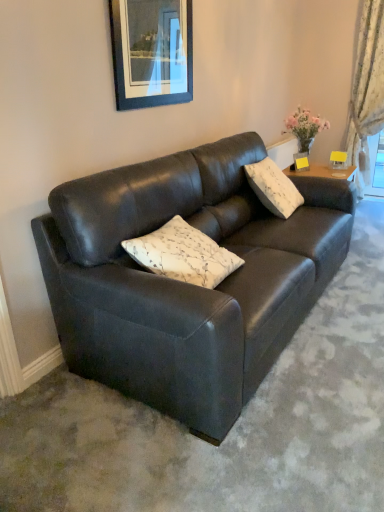
Question: Which direction should I rotate to face white floral-patterned cushion at center, positioned as the second pillow in back-to-front order, — up or down?

Choices:
 (A) up
 (B) down

Answer: (A)

Question: Does white floral-patterned cushion at center, the 1th pillow positioned from the left, turn towards white floral fabric curtain at right?

Choices:
 (A) yes
 (B) no

Answer: (B)

Question: Can you confirm if white floral-patterned cushion at center, the first pillow in the front-to-back sequence, is shorter than white floral fabric curtain at right?

Choices:
 (A) no
 (B) yes

Answer: (B)

Question: Is white floral-patterned cushion at center, the second pillow when ordered from right to left, located outside white floral fabric curtain at right?

Choices:
 (A) no
 (B) yes

Answer: (B)

Question: Is white floral-patterned cushion at center, the 1th pillow positioned from the left, positioned before white floral fabric curtain at right?

Choices:
 (A) yes
 (B) no

Answer: (A)

Question: Is the position of white floral-patterned cushion at center, positioned as the second pillow in back-to-front order, more distant than that of white floral fabric curtain at right?

Choices:
 (A) yes
 (B) no

Answer: (B)

Question: Is white floral-patterned cushion at center, positioned as the 1th pillow in bottom-to-top order, not close to white floral fabric curtain at right?

Choices:
 (A) yes
 (B) no

Answer: (A)

Question: Considering the relative sizes of matte black couch at center and matte black picture frame at upper center in the image provided, is matte black couch at center shorter than matte black picture frame at upper center?

Choices:
 (A) yes
 (B) no

Answer: (B)

Question: Is matte black couch at center in front of matte black picture frame at upper center?

Choices:
 (A) no
 (B) yes

Answer: (B)

Question: Is matte black couch at center next to matte black picture frame at upper center?

Choices:
 (A) yes
 (B) no

Answer: (B)

Question: Can you confirm if matte black couch at center is positioned to the left of matte black picture frame at upper center?

Choices:
 (A) yes
 (B) no

Answer: (B)

Question: From a real-world perspective, is matte black couch at center positioned over matte black picture frame at upper center based on gravity?

Choices:
 (A) no
 (B) yes

Answer: (A)

Question: Is matte black couch at center smaller than matte black picture frame at upper center?

Choices:
 (A) yes
 (B) no

Answer: (B)

Question: Are white floral fabric curtain at right and white floral-patterned cushion at center, the second pillow when ordered from right to left, far apart?

Choices:
 (A) yes
 (B) no

Answer: (A)